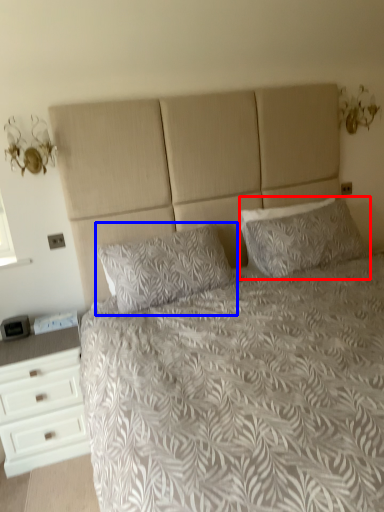
Question: Which object appears closest to the camera in this image, pillow (highlighted by a red box) or pillow (highlighted by a blue box)?

Choices:
 (A) pillow
 (B) pillow

Answer: (B)